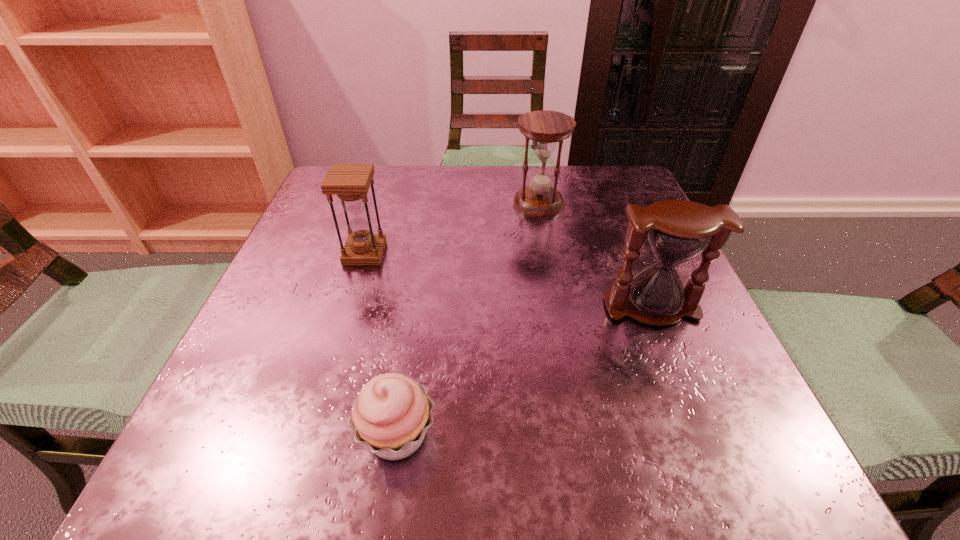
Find the location of a particular element. free space that is in between the second hourglass from left to right and the leftmost hourglass is located at coordinates (452, 228).

Where is `free space between the leftmost object and the shortest object`? The image size is (960, 540). free space between the leftmost object and the shortest object is located at coordinates (381, 344).

This screenshot has width=960, height=540. I want to click on object that is the second closest to the shortest object, so click(678, 230).

Locate which object is the third closest to the farthest hourglass. Please provide its 2D coordinates. Your answer should be formatted as a tuple, i.e. [(x, y)], where the tuple contains the x and y coordinates of a point satisfying the conditions above.

[(391, 415)]

Select which hourglass is the second closest to the cupcake. Please provide its 2D coordinates. Your answer should be formatted as a tuple, i.e. [(x, y)], where the tuple contains the x and y coordinates of a point satisfying the conditions above.

[(678, 230)]

Locate an element on the screen. The height and width of the screenshot is (540, 960). the second closest hourglass to the rightmost object is located at coordinates (350, 182).

Locate an element on the screen. The image size is (960, 540). vacant space that satisfies the following two spatial constraints: 1. on the back side of the second object from left to right; 2. on the right side of the second object from right to left is located at coordinates (432, 204).

Identify the location of vacant space that satisfies the following two spatial constraints: 1. on the front side of the nearest object; 2. on the right side of the third nearest object. 309,435.